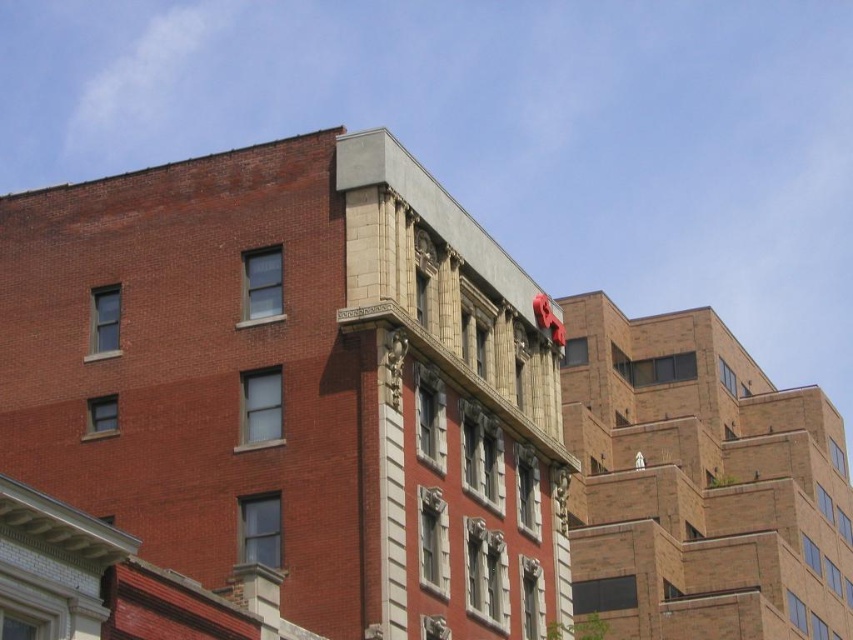
Question: Does smooth concrete peak at upper center come in front of brown brick building at upper right?

Choices:
 (A) yes
 (B) no

Answer: (A)

Question: Which of the following is the farthest from the observer?

Choices:
 (A) brown brick building at upper right
 (B) smooth concrete peak at upper center

Answer: (A)

Question: Can you confirm if smooth concrete peak at upper center is bigger than brown brick building at upper right?

Choices:
 (A) yes
 (B) no

Answer: (B)

Question: Is smooth concrete peak at upper center bigger than brown brick building at upper right?

Choices:
 (A) yes
 (B) no

Answer: (B)